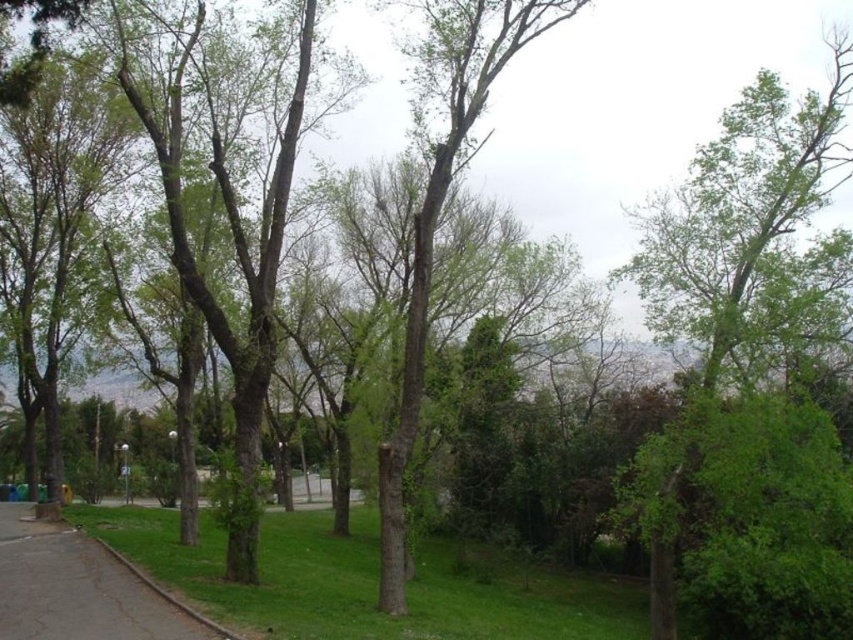
Question: Which point is farther to the camera?

Choices:
 (A) (422, 54)
 (B) (67, 579)

Answer: (A)

Question: Which of the following is the farthest from the observer?

Choices:
 (A) (419, 269)
 (B) (56, 611)

Answer: (A)

Question: Does green leafy tree at center have a lesser width compared to concrete sidewalk at lower left?

Choices:
 (A) yes
 (B) no

Answer: (A)

Question: Is green leafy tree at center wider than concrete sidewalk at lower left?

Choices:
 (A) yes
 (B) no

Answer: (B)

Question: Is green leafy tree at center smaller than concrete sidewalk at lower left?

Choices:
 (A) yes
 (B) no

Answer: (B)